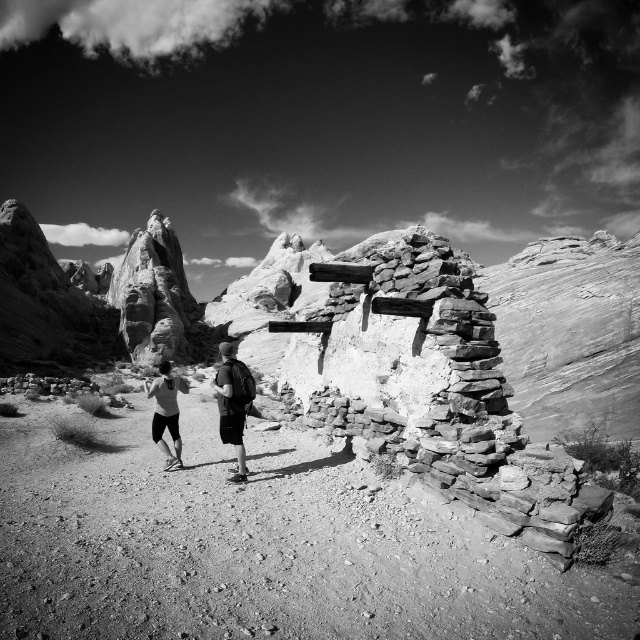
Question: Estimate the real-world distances between objects in this image. Which object is closer to the matte black backpacks at center?

Choices:
 (A) dark gray backpack at center
 (B) matte black shorts at center

Answer: (B)

Question: Is matte black backpacks at center positioned behind matte black shorts at center?

Choices:
 (A) yes
 (B) no

Answer: (B)

Question: Does matte black backpacks at center have a smaller size compared to dark gray backpack at center?

Choices:
 (A) yes
 (B) no

Answer: (B)

Question: Is dark gray backpack at center positioned in front of matte black shorts at center?

Choices:
 (A) no
 (B) yes

Answer: (B)

Question: Which point is closer to the camera?

Choices:
 (A) (186, 388)
 (B) (250, 394)
 (C) (237, 458)

Answer: (C)

Question: Which point is farther to the camera?

Choices:
 (A) (225, 349)
 (B) (160, 397)

Answer: (B)